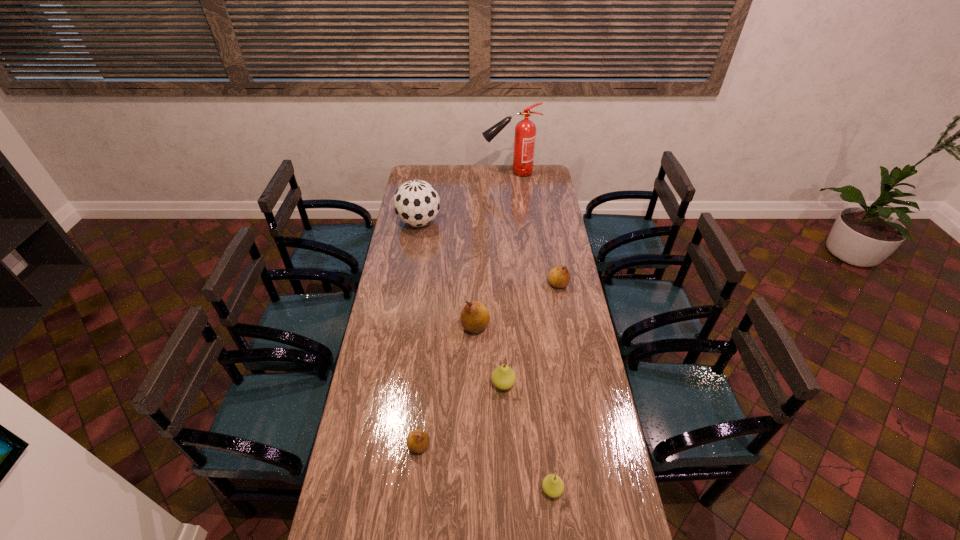
Point out which pear is positioned as the third nearest to the nearest brown pear. Please provide its 2D coordinates. Your answer should be formatted as a tuple, i.e. [(x, y)], where the tuple contains the x and y coordinates of a point satisfying the conditions above.

[(475, 317)]

Select which brown pear appears as the closest to the smallest brown pear. Please provide its 2D coordinates. Your answer should be formatted as a tuple, i.e. [(x, y)], where the tuple contains the x and y coordinates of a point satisfying the conditions above.

[(475, 317)]

You are a GUI agent. You are given a task and a screenshot of the screen. Output one action in this format:
    pyautogui.click(x=<x>, y=<y>)
    Task: Click on the brown pear that is the third nearest to the tallest object
    
    Given the screenshot: What is the action you would take?
    pyautogui.click(x=418, y=441)

At what (x,y) coordinates should I click in order to perform the action: click on vacant region that satisfies the following two spatial constraints: 1. at the nozzle end of the red fire extinguisher; 2. on the front side of the nearest brown pear. Please return your answer as a coordinate pair (x, y). The width and height of the screenshot is (960, 540). Looking at the image, I should click on (535, 446).

At what (x,y) coordinates should I click in order to perform the action: click on free space that satisfies the following two spatial constraints: 1. at the nozzle end of the fire extinguisher; 2. on the back side of the third farthest object. Please return your answer as a coordinate pair (x, y). Looking at the image, I should click on (520, 284).

Find the location of a particular element. free spot that satisfies the following two spatial constraints: 1. at the nozzle end of the farthest object; 2. on the front side of the leftmost brown pear is located at coordinates (535, 446).